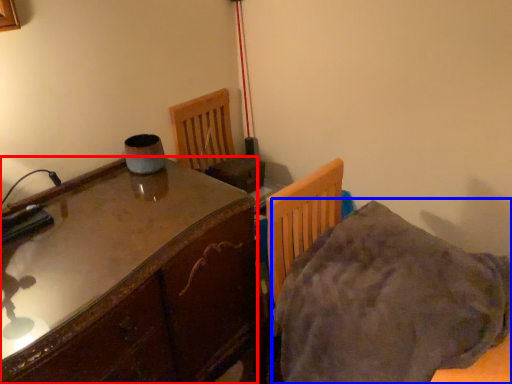
Question: Which of the following is the closest to the observer, table (highlighted by a red box) or blanket (highlighted by a blue box)?

Choices:
 (A) table
 (B) blanket

Answer: (B)